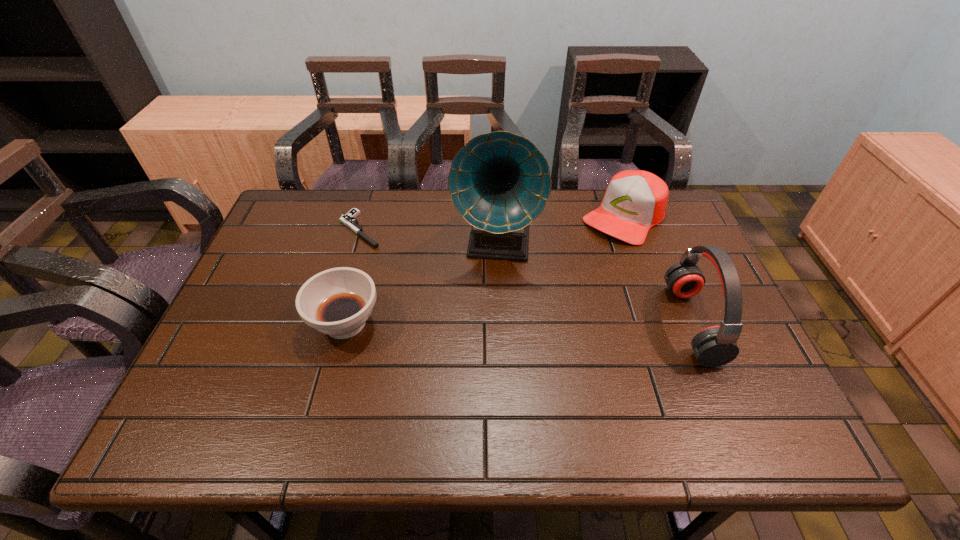
This screenshot has width=960, height=540. What are the coordinates of `the second shortest object` in the screenshot? It's located at (337, 302).

You are a GUI agent. You are given a task and a screenshot of the screen. Output one action in this format:
    pyautogui.click(x=<x>, y=<y>)
    Task: Click on the earphone
    This screenshot has height=540, width=960.
    Given the screenshot: What is the action you would take?
    pyautogui.click(x=714, y=346)

This screenshot has width=960, height=540. What are the coordinates of `the tallest object` in the screenshot? It's located at (499, 182).

Where is `phonograph_record`? This screenshot has height=540, width=960. phonograph_record is located at coordinates (499, 182).

Image resolution: width=960 pixels, height=540 pixels. I want to click on the shortest object, so click(x=348, y=219).

Locate an element on the screen. Image resolution: width=960 pixels, height=540 pixels. baseball cap is located at coordinates point(635,200).

You are a GUI agent. You are given a task and a screenshot of the screen. Output one action in this format:
    pyautogui.click(x=<x>, y=<y>)
    Task: Click on the blank area located on the back of the soup bowl
    The height and width of the screenshot is (540, 960).
    Given the screenshot: What is the action you would take?
    pyautogui.click(x=370, y=231)

You are a GUI agent. You are given a task and a screenshot of the screen. Output one action in this format:
    pyautogui.click(x=<x>, y=<y>)
    Task: Click on the free space located 0.070m on the ear cups of the second tallest object
    Image resolution: width=960 pixels, height=540 pixels.
    Given the screenshot: What is the action you would take?
    pyautogui.click(x=738, y=323)

Image resolution: width=960 pixels, height=540 pixels. Identify the location of free region located from the horn of the third object from left to right. (479, 394).

Locate an element on the screen. Image resolution: width=960 pixels, height=540 pixels. vacant space situated from the horn of the third object from left to right is located at coordinates (488, 315).